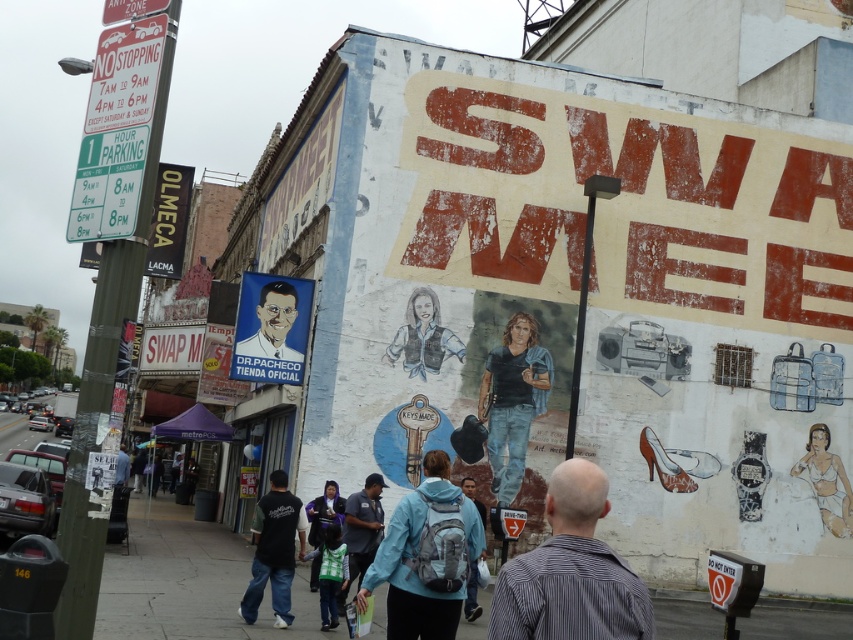
Question: Is blue jeans at center bigger than blue shirt at lower left?

Choices:
 (A) no
 (B) yes

Answer: (A)

Question: Estimate the real-world distances between objects in this image. Which object is farther from the blue fabric jacket at center?

Choices:
 (A) dark blue jeans at lower left
 (B) matte blue jacket at center
 (C) colored pencil drawing of a person at center
 (D) blue shirt at lower left

Answer: (D)

Question: Is the position of metallic green parking sign at upper left less distant than that of blue fabric jacket at center?

Choices:
 (A) no
 (B) yes

Answer: (B)

Question: Which of the following is the farthest from the observer?

Choices:
 (A) (364, 560)
 (B) (611, 605)
 (C) (463, 600)
 (D) (287, 625)

Answer: (A)

Question: Does metallic green parking sign at upper left appear on the left side of dark blue shirt at center?

Choices:
 (A) yes
 (B) no

Answer: (A)

Question: Which of the following is the farthest from the observer?

Choices:
 (A) white paper poster at center
 (B) blue fabric jacket at center
 (C) striped shirt at center
 (D) blue shirt at lower left

Answer: (A)